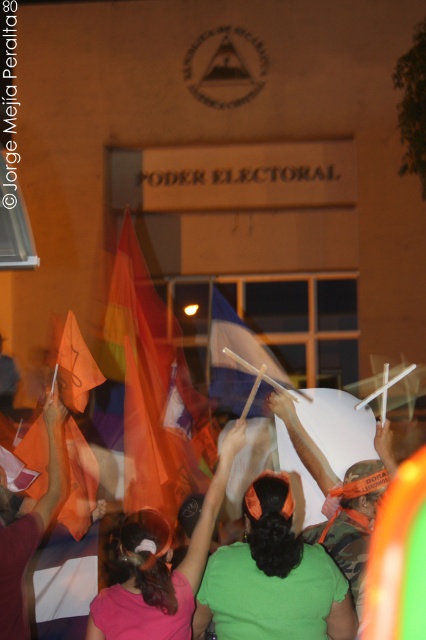
I want to click on green fabric headband at center, so click(x=273, y=580).

Consider the image. Is the position of green fabric headband at center more distant than that of pink fabric headband at upper center?

No, green fabric headband at center is closer to the viewer.

The width and height of the screenshot is (426, 640). What do you see at coordinates (273, 580) in the screenshot?
I see `green fabric headband at center` at bounding box center [273, 580].

Where is `green fabric headband at center`? green fabric headband at center is located at coordinates (273, 580).

Is point (276, 504) farther from camera compared to point (250, 384)?

No.

Locate an element on the screen. green fabric headband at center is located at coordinates (273, 580).

From the picture: Is blue fabric flag at center bigger than orange fabric flag at center?

Yes.

Which of these two, blue fabric flag at center or orange fabric flag at center, stands shorter?

With less height is orange fabric flag at center.

Find the location of a particular element. The width and height of the screenshot is (426, 640). blue fabric flag at center is located at coordinates 235,358.